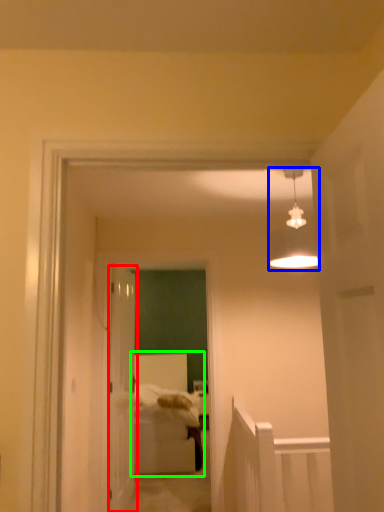
Question: Which object is the closest to the door (highlighted by a red box)? Choose among these: light fixture (highlighted by a blue box) or bed (highlighted by a green box).

Choices:
 (A) light fixture
 (B) bed

Answer: (B)